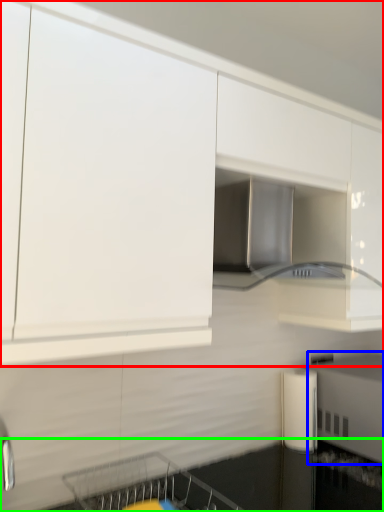
Question: Based on their relative distances, which object is nearer to cabinetry (highlighted by a red box)? Choose from appliance (highlighted by a blue box) and countertop (highlighted by a green box).

Choices:
 (A) appliance
 (B) countertop

Answer: (A)